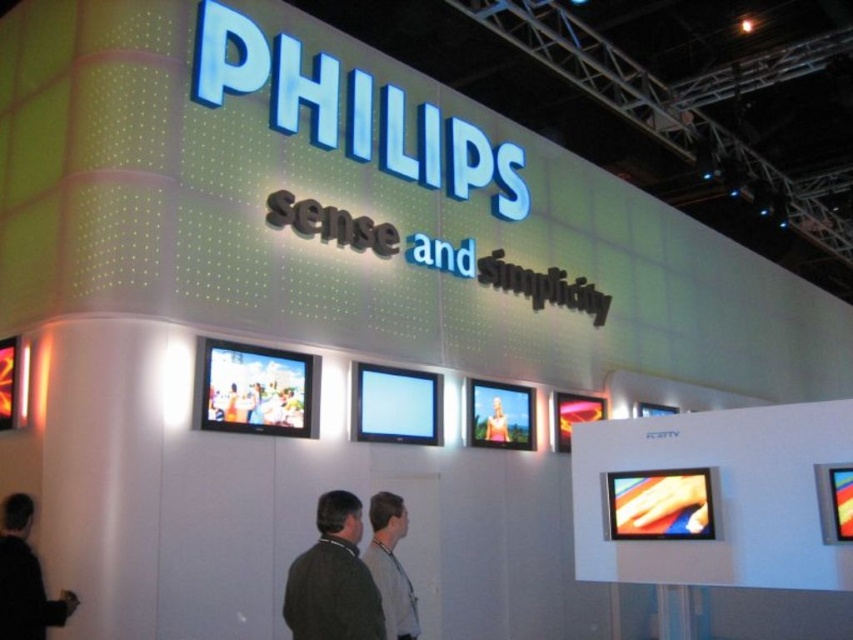
Who is lower down, dark gray sweater at lower center or gray fabric shirt at lower center?

gray fabric shirt at lower center

From the picture: How distant is dark gray sweater at lower center from gray fabric shirt at lower center?

dark gray sweater at lower center is 18.85 inches from gray fabric shirt at lower center.

Is point (358, 566) positioned behind point (397, 538)?

No, it is not.

This screenshot has width=853, height=640. Find the location of `dark gray sweater at lower center`. dark gray sweater at lower center is located at coordinates (334, 579).

From the picture: Does dark gray sweater at lower center appear over smooth skin person at center?

Actually, dark gray sweater at lower center is below smooth skin person at center.

Between dark gray sweater at lower center and smooth skin person at center, which one appears on the right side from the viewer's perspective?

Positioned to the right is smooth skin person at center.

The width and height of the screenshot is (853, 640). What are the coordinates of `dark gray sweater at lower center` in the screenshot? It's located at (334, 579).

Which is behind, point (407, 577) or point (488, 440)?

Point (488, 440)

Is point (390, 552) less distant than point (503, 438)?

That is True.

The height and width of the screenshot is (640, 853). What do you see at coordinates (392, 564) in the screenshot?
I see `gray fabric shirt at lower center` at bounding box center [392, 564].

Image resolution: width=853 pixels, height=640 pixels. Identify the location of gray fabric shirt at lower center. (392, 564).